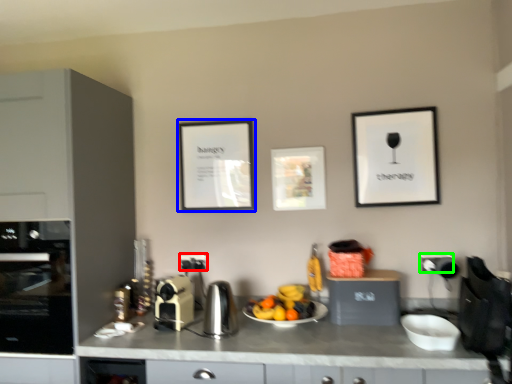
Question: Which is nearer to the electric outlet (highlighted by a red box)? picture frame (highlighted by a blue box) or electric outlet (highlighted by a green box).

Choices:
 (A) picture frame
 (B) electric outlet

Answer: (A)